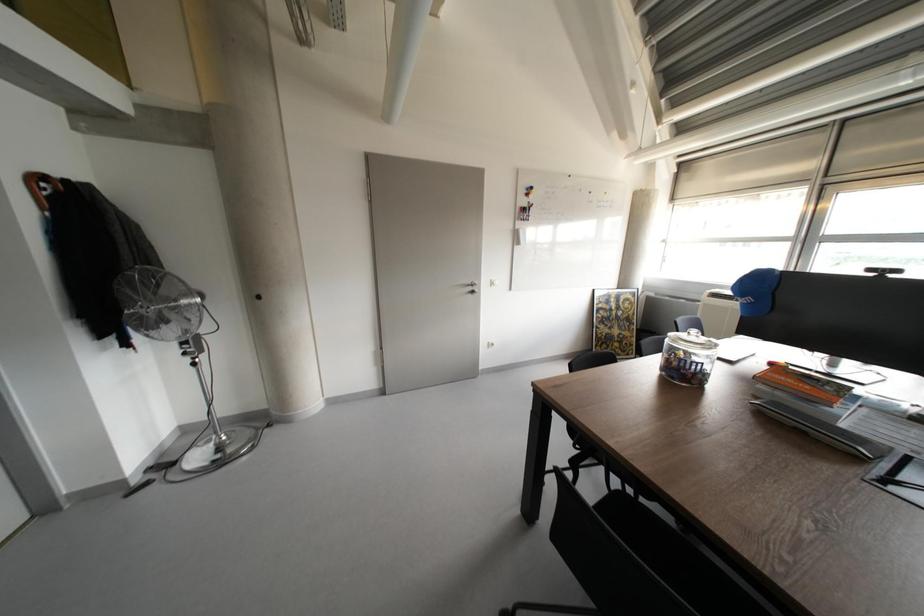
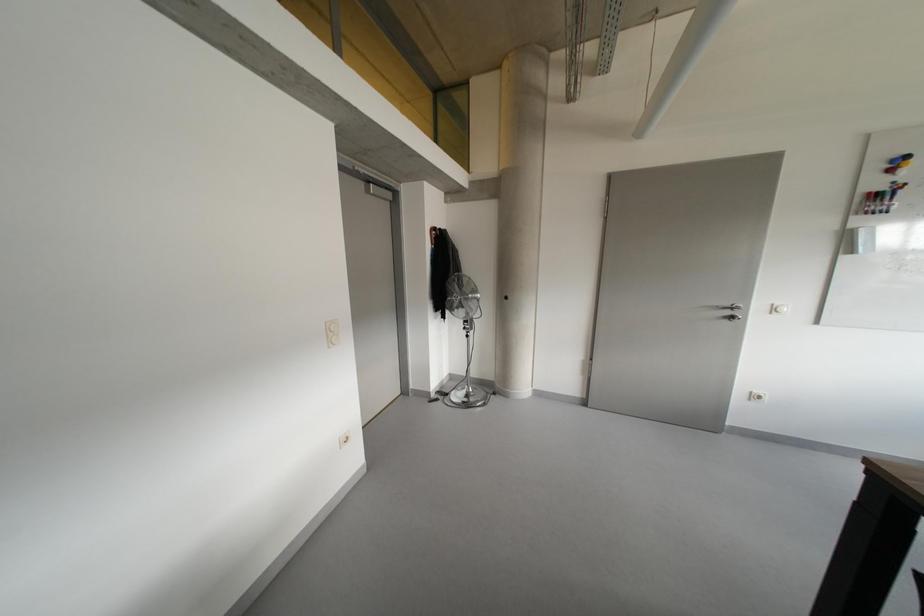
Question: Based on the continuous images, in which direction is the camera rotating? Reply with the corresponding letter.

Choices:
 (A) Left
 (B) Right
 (C) Up
 (D) Down

Answer: (A)